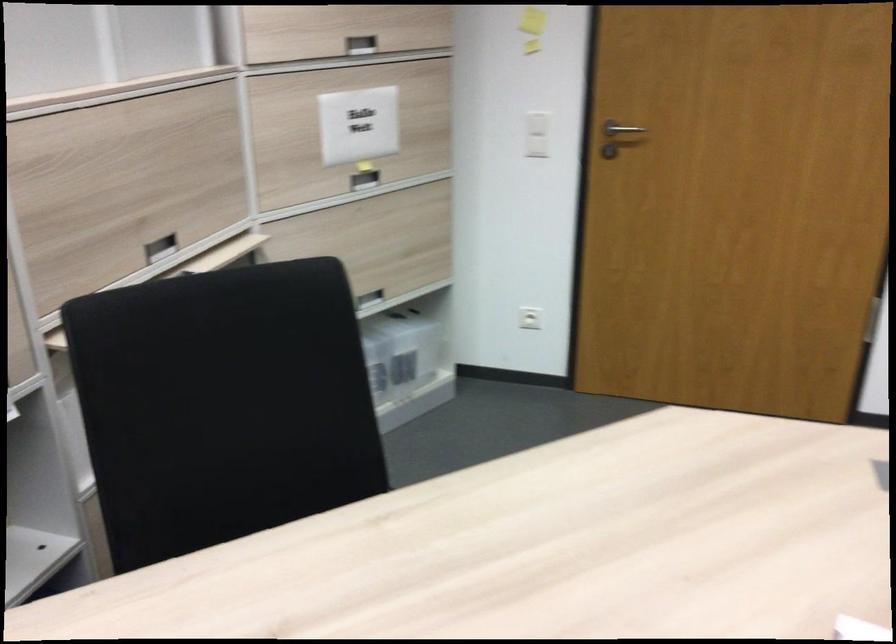
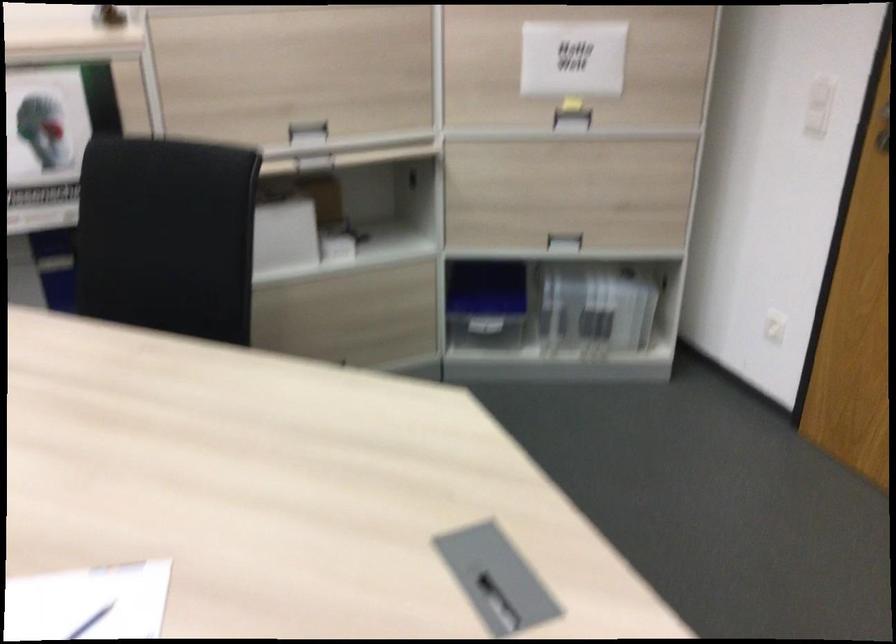
Where in the second image is the point corresponding to point (367, 178) from the first image?

(572, 120)